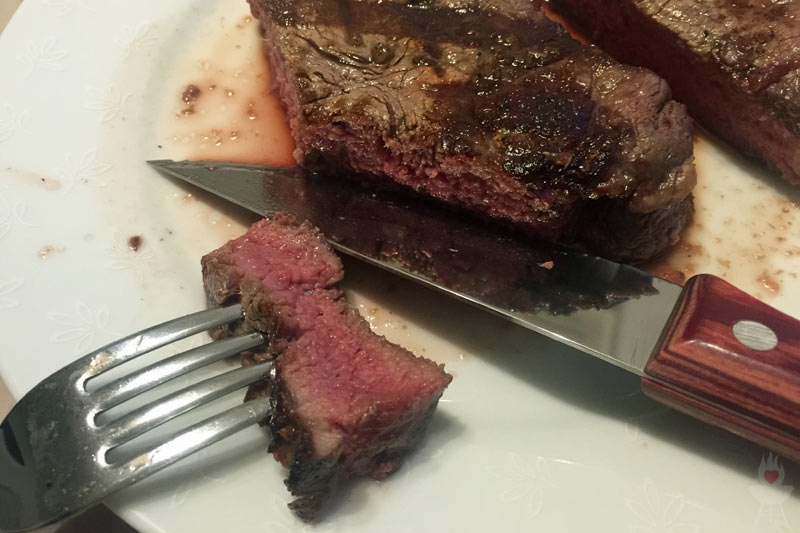
Image resolution: width=800 pixels, height=533 pixels. I want to click on knife handle, so click(x=736, y=354).